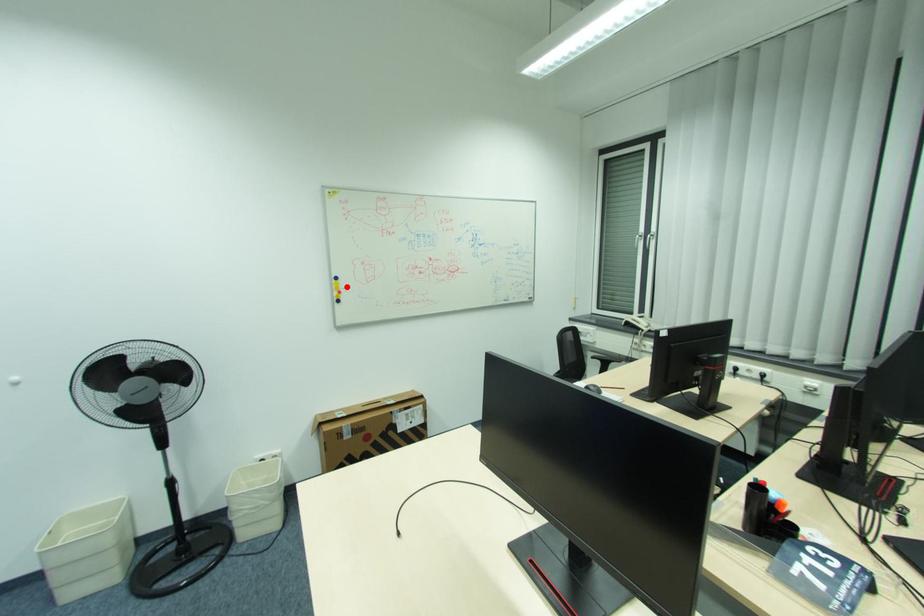
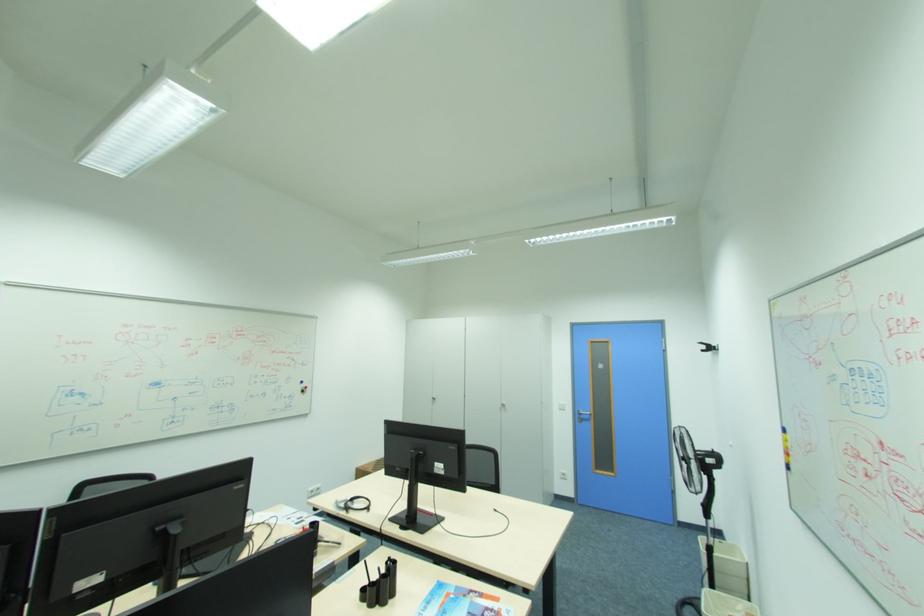
The point at the highlighted location is marked in the first image. Where is the corresponding point in the second image?

(794, 446)